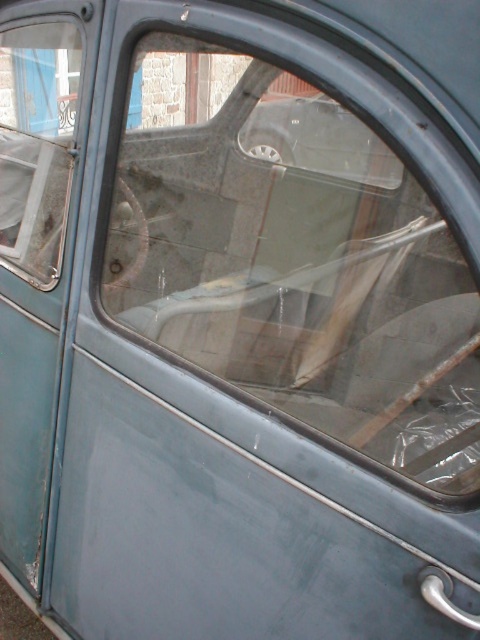
You are a mechanic working on a car door. You need to install a new part between the transparent plastic windshield at center and the transparent plastic window at upper left. The part requires a minimum of 15 inches of space. Can you confirm if there is enough space between them?

The transparent plastic windshield at center is 18.41 inches away from the transparent plastic window at upper left, which is more than the required 15 inches. Therefore, there is sufficient space to install the new part between them.

You are a mechanic inspecting the car door window area. You notice two points marked on the door panel. The first point is at coordinate point (x=223, y=134) and the second at point (x=33, y=148). Based on the image, which point is closer to the front of the car?

Point (x=223, y=134) is in front of point (x=33, y=148), so the first point is closer to the front of the car.